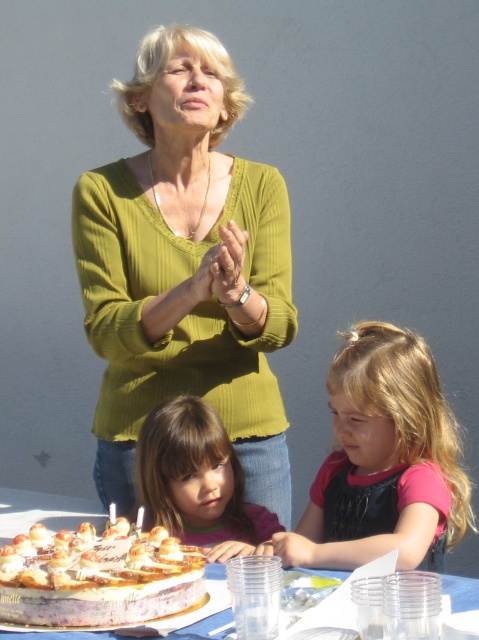
Question: Which point is farther to the camera?

Choices:
 (A) golden glaze cake at lower left
 (B) smooth white cake at lower center
 (C) matte pink shirt at lower center
 (D) brown matte hair at center

Answer: (B)

Question: Which point is closer to the camera taking this photo?

Choices:
 (A) (1, 614)
 (B) (351, 468)
 (C) (53, 525)
 (D) (258, 360)

Answer: (A)

Question: Does matte pink shirt at lower center come behind brown matte hair at center?

Choices:
 (A) no
 (B) yes

Answer: (A)

Question: Does matte pink shirt at lower center have a lesser width compared to brown matte hair at center?

Choices:
 (A) yes
 (B) no

Answer: (B)

Question: Does golden glaze cake at lower left lie in front of smooth white cake at lower center?

Choices:
 (A) yes
 (B) no

Answer: (A)

Question: Among these points, which one is farthest from the camera?

Choices:
 (A) (441, 497)
 (B) (89, 584)
 (C) (79, 499)

Answer: (C)